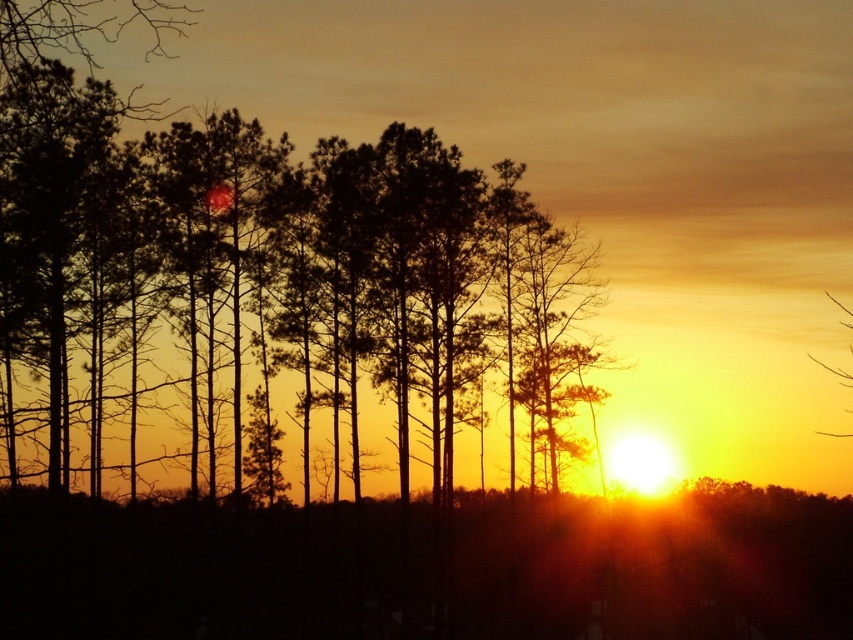
Does silhouette tree at center have a larger size compared to translucent yellow sky at upper right?

Correct, silhouette tree at center is larger in size than translucent yellow sky at upper right.

How far apart are silhouette tree at center and translucent yellow sky at upper right?

silhouette tree at center is 84.21 feet from translucent yellow sky at upper right.

Who is more distant from viewer, (264, 358) or (834, 300)?

The point (834, 300) is more distant.

This screenshot has height=640, width=853. Identify the location of silhouette tree at center. (276, 273).